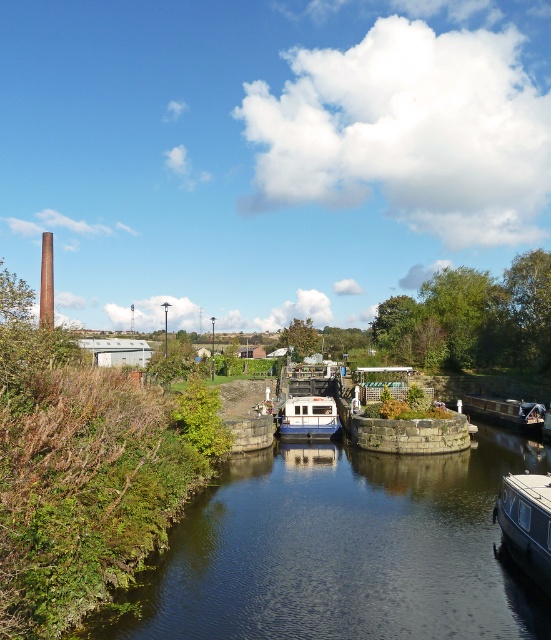
You are standing at the lock structure in the canal scene and want to determine the distance between two points marked on a map. The first point is labeled as point (193,579) and the second point is labeled as point (526,490). Based on the scene, which point is closer to your current position?

Point (193,579) is closer to the camera than point (526,490), so the first point is closer to your current position.

You are a boat operator who needs to navigate through the lock. You see the white glossy boat at lower right and the white glossy boat at center. Which boat is wider and can potentially block the passage if not maneuvered properly?

The white glossy boat at lower right is wider than the white glossy boat at center, so it could potentially block the passage if not maneuvered properly.

Looking at this image, you are a passenger on the white glossy boat at lower right. You want to jump into the dark green water at center. Is the water below the boat?

The dark green water at center is located below the white glossy boat at lower right, so yes, the water is directly below the boat.